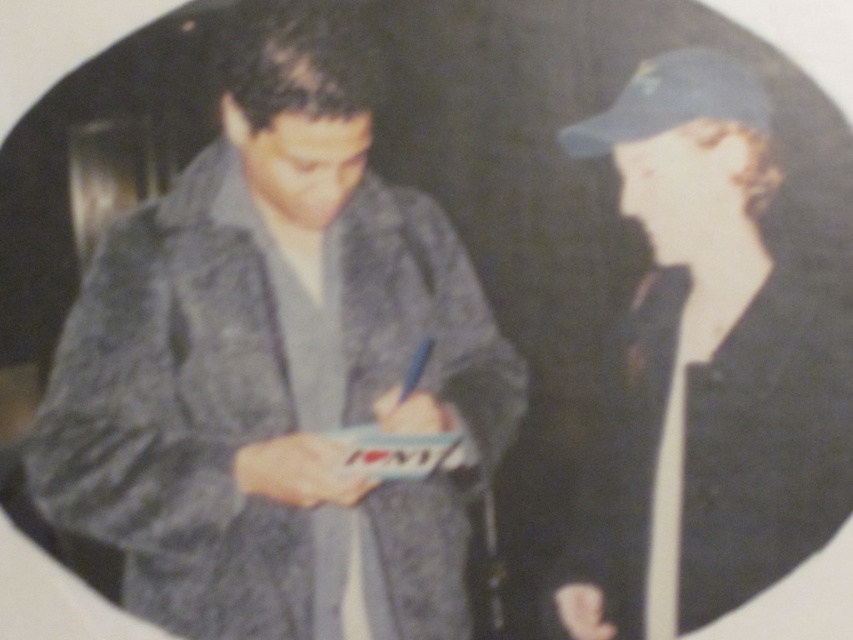
Describe the element at coordinates (276, 365) in the screenshot. I see `velvet-like gray coat at center` at that location.

This screenshot has height=640, width=853. I want to click on velvet-like gray coat at center, so [276, 365].

Locate an element on the screen. Image resolution: width=853 pixels, height=640 pixels. velvet-like gray coat at center is located at coordinates (276, 365).

Is point (770, 406) closer to viewer compared to point (735, 115)?

Yes, point (770, 406) is in front of point (735, 115).

Is point (834, 452) farther from viewer compared to point (613, 118)?

No, (834, 452) is closer to viewer.

The width and height of the screenshot is (853, 640). What do you see at coordinates (708, 365) in the screenshot? I see `matte blue cap at upper right` at bounding box center [708, 365].

Where is `matte blue cap at upper right`? The width and height of the screenshot is (853, 640). matte blue cap at upper right is located at coordinates (708, 365).

From the picture: Who is more distant from viewer, (119, 253) or (733, 240)?

Positioned behind is point (119, 253).

Is velvet-like gray coat at center to the right of matte blue cap at upper right from the viewer's perspective?

No, velvet-like gray coat at center is not to the right of matte blue cap at upper right.

Is point (374, 525) more distant than point (637, 440)?

That is False.

In order to click on velvet-like gray coat at center in this screenshot , I will do `click(276, 365)`.